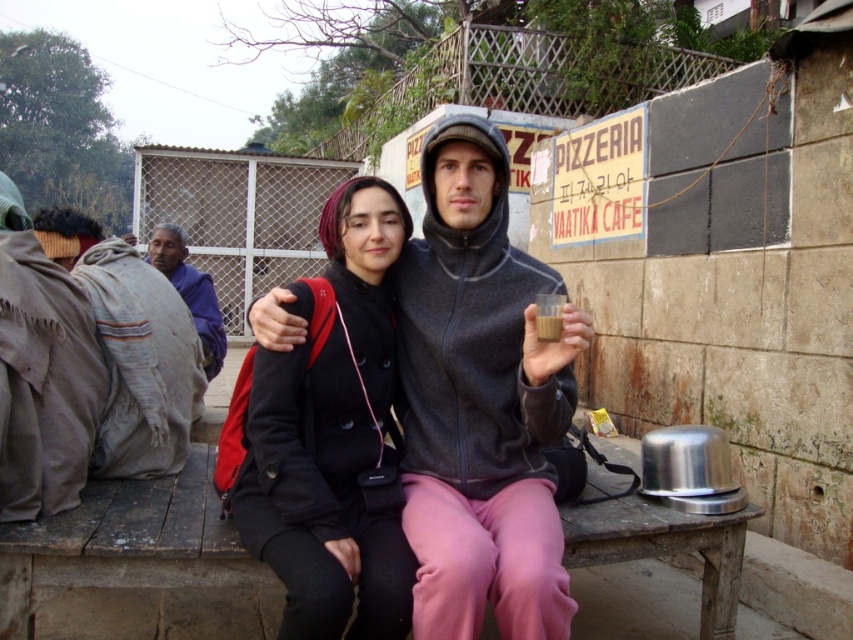
Question: Considering the real-world distances, which object is farthest from the purple fabric at left?

Choices:
 (A) black matte coat at center
 (B) brown woolen blanket at left

Answer: (A)

Question: Can you confirm if black matte coat at center is positioned to the right of brown woolen blanket at left?

Choices:
 (A) no
 (B) yes

Answer: (B)

Question: From the image, what is the correct spatial relationship of matte black coat at center in relation to purple fabric at left?

Choices:
 (A) above
 (B) below

Answer: (B)

Question: Is black matte coat at center to the left of brown woolen blanket at left from the viewer's perspective?

Choices:
 (A) yes
 (B) no

Answer: (B)

Question: Which point is closer to the camera taking this photo?

Choices:
 (A) (206, 314)
 (B) (386, 593)

Answer: (B)

Question: Which of the following is the farthest from the observer?

Choices:
 (A) matte black coat at center
 (B) black matte coat at center

Answer: (A)